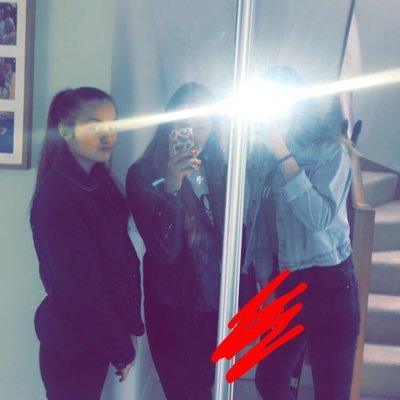
Locate an element on the screen. This screenshot has height=400, width=400. phone is located at coordinates (183, 144), (264, 119).